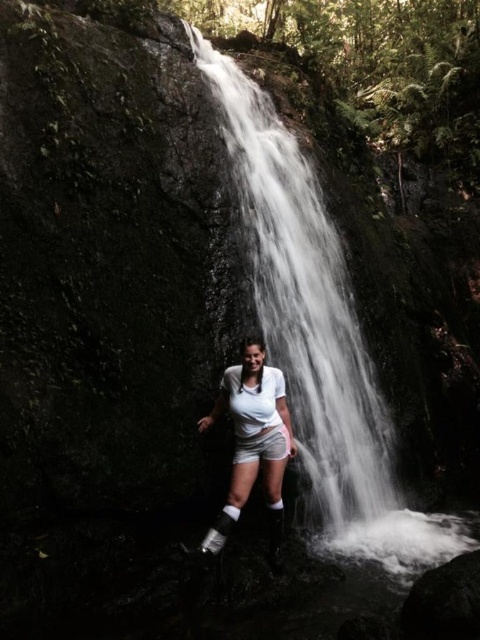
You are a photographer trying to capture the white smooth waterfall at center and the white cotton shorts at center in the same frame. Which object should you zoom in on to ensure both are visible without cropping?

The white smooth waterfall at center has a lesser width compared to white cotton shorts at center, so you should zoom in on the white cotton shorts at center to ensure both fit in the frame.

Based on the coordinates provided, what object is located at point (x=252, y=442) in the scene?

The point (x=252, y=442) marks the location of the white matte shorts at center.